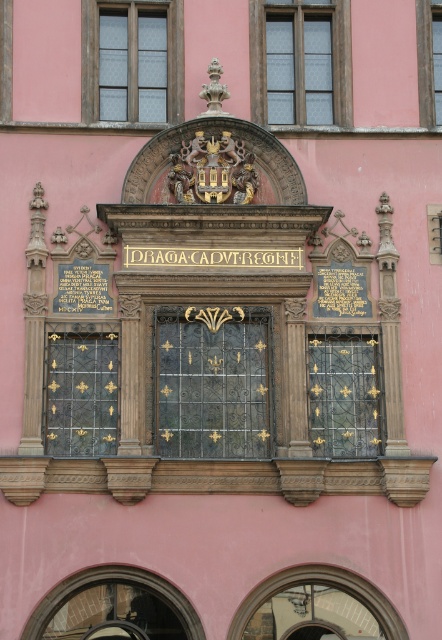
You are standing in front of the building and want to locate the point at coordinates (301,60). Based on the scene description, which object is this point located on?

The point at coordinates (301,60) is located on the clear glass window at upper center.